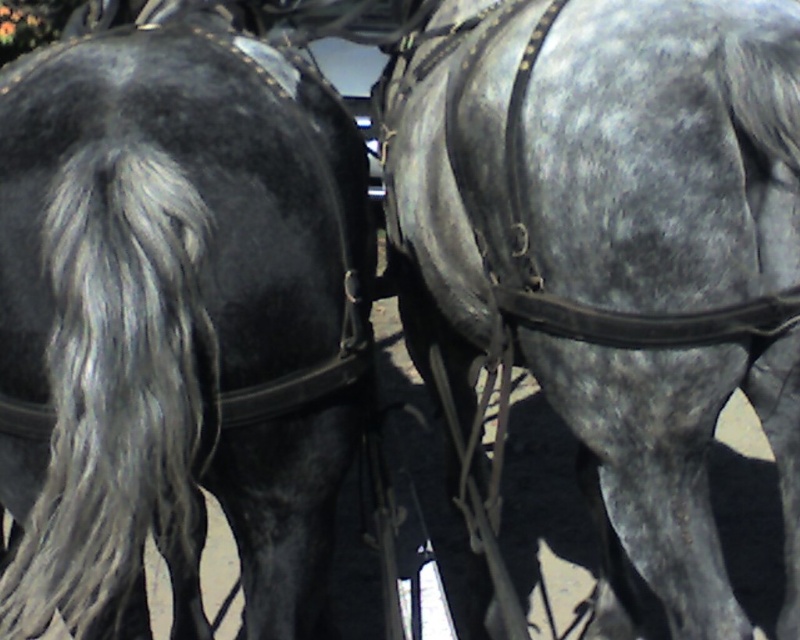
Question: Is shiny black horse at left smaller than gray textured horse at center?

Choices:
 (A) no
 (B) yes

Answer: (B)

Question: Is shiny black horse at left smaller than gray textured horse at center?

Choices:
 (A) no
 (B) yes

Answer: (B)

Question: Where is shiny black horse at left located in relation to gray textured horse at center in the image?

Choices:
 (A) right
 (B) left

Answer: (B)